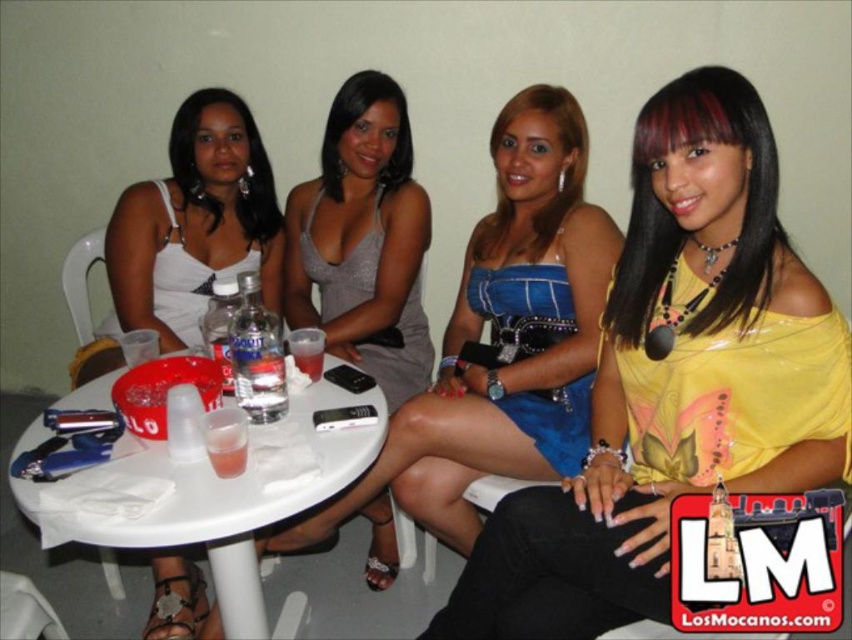
Question: Which object is closer to the camera taking this photo?

Choices:
 (A) clear glass bottle at table center
 (B) translucent plastic cup at table center
 (C) satin silver dress at center

Answer: (A)

Question: Does satin silver dress at center lie in front of clear glass bottle at table center?

Choices:
 (A) no
 (B) yes

Answer: (A)

Question: Which object is farther from the camera taking this photo?

Choices:
 (A) satin silver dress at center
 (B) white plastic table at center
 (C) blue satin dress at center

Answer: (A)

Question: Which of the following is the farthest from the observer?

Choices:
 (A) (415, 320)
 (B) (188, 512)
 (C) (199, 170)
 (D) (652, 182)

Answer: (A)

Question: Does white satin dress at left lie behind shiny silver dress at center?

Choices:
 (A) no
 (B) yes

Answer: (A)

Question: Can you confirm if matte black dress at upper left is bigger than shiny silver dress at center?

Choices:
 (A) no
 (B) yes

Answer: (B)